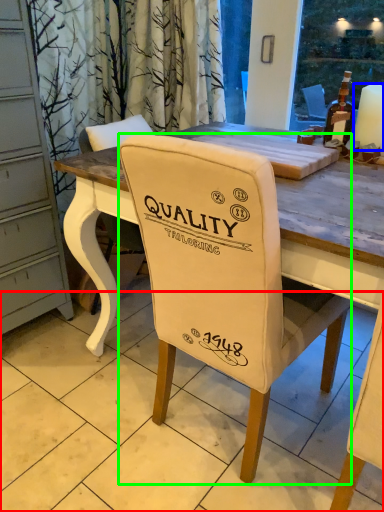
Question: Which object is the closest to the tile (highlighted by a red box)? Choose among these: candle (highlighted by a blue box) or chair (highlighted by a green box).

Choices:
 (A) candle
 (B) chair

Answer: (B)